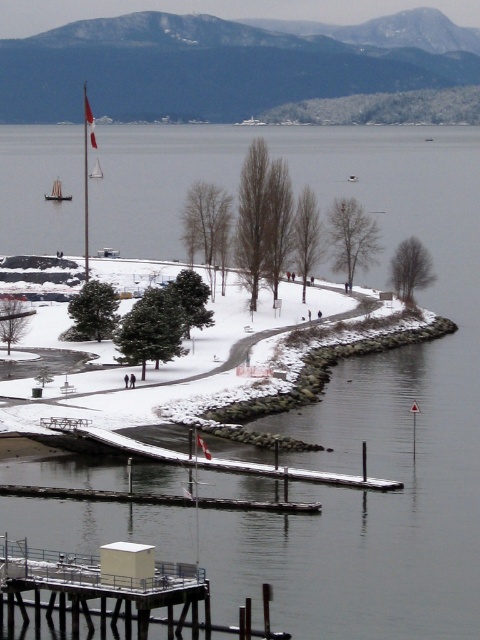
You are planning to take a photo of both the wooden sailboat at upper left and the white sailboat at upper left from the dock. Which boat should you position yourself closer to in order to capture both in the frame without one blocking the other?

You should position yourself closer to the wooden sailboat at upper left since it is in front of the white sailboat at upper left, allowing both to be visible without obstruction.

From the picture: You are standing at the center of the image and want to reach the metallic gray dock at lower left. Which direction should you move in to get there?

You should move towards the lower left direction to reach the metallic gray dock at lower left as it is located at point (109, 598).

You are planning to install a new flagpole on the metallic gray dock at lower left. Considering the height difference between the dock and the white sailboat at upper left, will the flagpole be visible from the sailboat?

The metallic gray dock at lower left has a lesser height compared to the white sailboat at upper left. Since the dock is shorter, the flagpole on it may not be fully visible from the sailboat unless it is tall enough to rise above the dock.